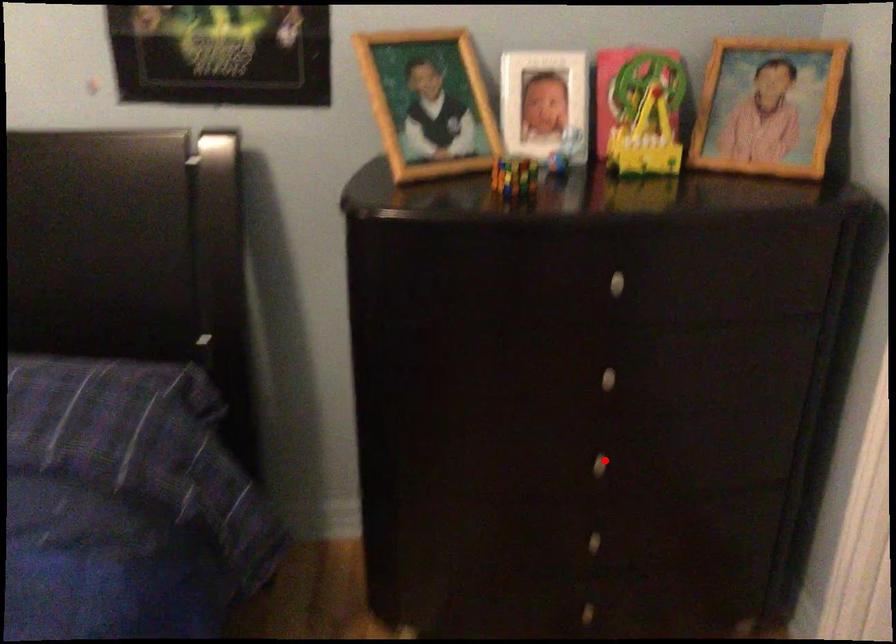
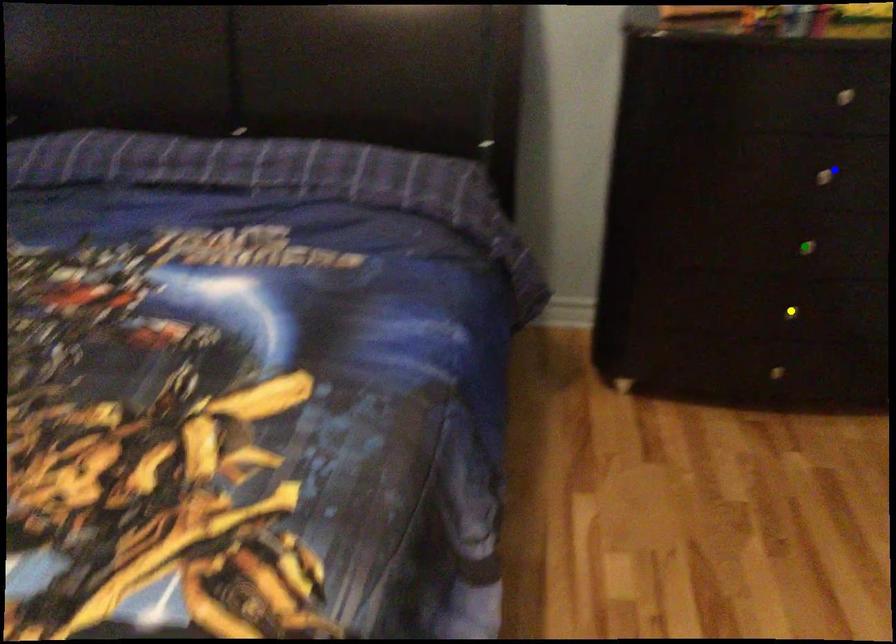
Question: I am providing you with two images of the same scene from different viewpoints. A red point is marked on the first image. You are given multiple points on the second image. Which point in image 2 is actually the same real-world point as the red point in image 1?

Choices:
 (A) green point
 (B) yellow point
 (C) blue point

Answer: (A)